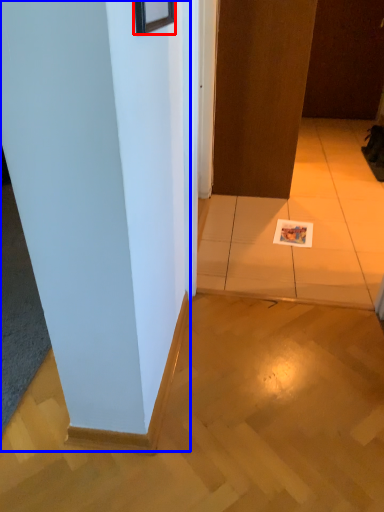
Question: Which point is further to the camera, picture frame (highlighted by a red box) or pillar (highlighted by a blue box)?

Choices:
 (A) picture frame
 (B) pillar

Answer: (B)